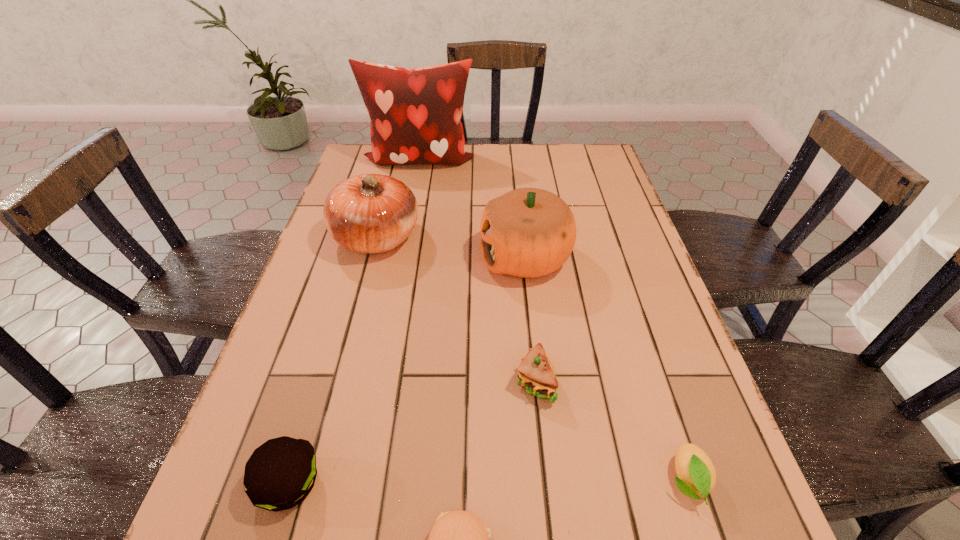
This screenshot has width=960, height=540. I want to click on the farthest object, so click(x=415, y=114).

I want to click on cushion, so click(x=415, y=114).

At what (x,y) coordinates should I click in order to perform the action: click on the right pumpkin. Please return your answer as a coordinate pair (x, y). Looking at the image, I should click on (528, 232).

What are the coordinates of `the left pumpkin` in the screenshot? It's located at (369, 213).

I want to click on the fourth nearest object, so click(536, 375).

At what (x,y) coordinates should I click in order to perform the action: click on the left patty. Please return your answer as a coordinate pair (x, y). This screenshot has height=540, width=960. Looking at the image, I should click on (280, 473).

The image size is (960, 540). What are the coordinates of `lemon` in the screenshot? It's located at (696, 473).

Where is `the rightmost object`? The image size is (960, 540). the rightmost object is located at coordinates (696, 473).

This screenshot has height=540, width=960. In order to click on free region located on the front-facing side of the cushion in this screenshot , I will do `click(414, 188)`.

The image size is (960, 540). I want to click on vacant region located 0.160m on the face of the right pumpkin, so click(x=418, y=258).